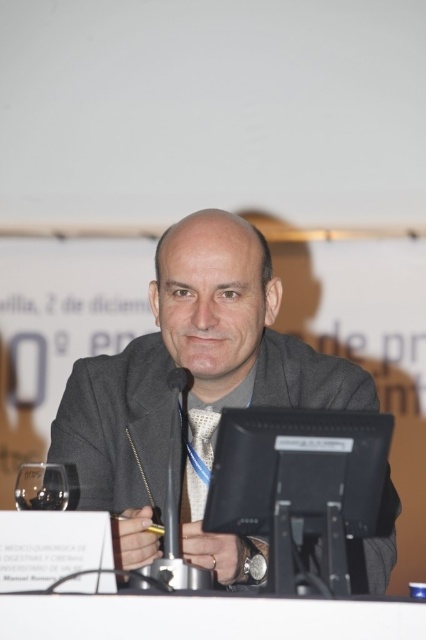
Question: Which of the following is the farthest from the observer?

Choices:
 (A) black plastic table at lower center
 (B) gray woolen suit at center

Answer: (B)

Question: Can you confirm if gray woolen suit at center is thinner than silver textured tie at center?

Choices:
 (A) yes
 (B) no

Answer: (B)

Question: Does black plastic table at lower center lie in front of silver textured tie at center?

Choices:
 (A) no
 (B) yes

Answer: (B)

Question: Can you confirm if gray woolen suit at center is positioned below black plastic table at lower center?

Choices:
 (A) no
 (B) yes

Answer: (A)

Question: Which of the following is the closest to the observer?

Choices:
 (A) (201, 481)
 (B) (111, 627)
 (C) (215, 570)

Answer: (B)

Question: Which point is farther to the camera?

Choices:
 (A) (184, 486)
 (B) (204, 268)

Answer: (A)